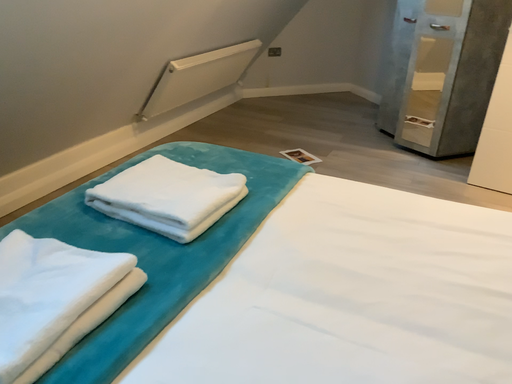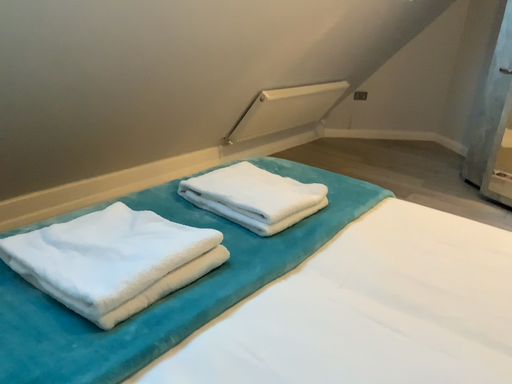
Question: Which way did the camera rotate in the video?

Choices:
 (A) rotated upward
 (B) rotated downward

Answer: (A)